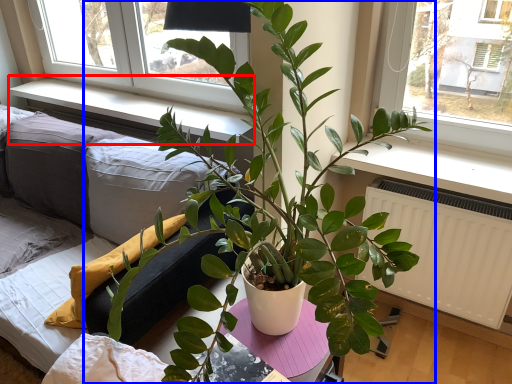
Question: Which of the following is the farthest to the observer, window sill (highlighted by a red box) or houseplant (highlighted by a blue box)?

Choices:
 (A) window sill
 (B) houseplant

Answer: (A)